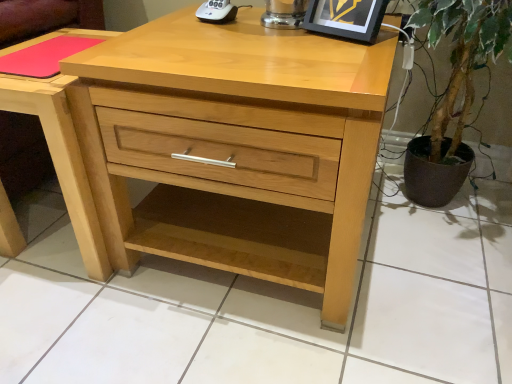
Locate an element on the screen. free location in front of white plastic remote control at upper center is located at coordinates (233, 38).